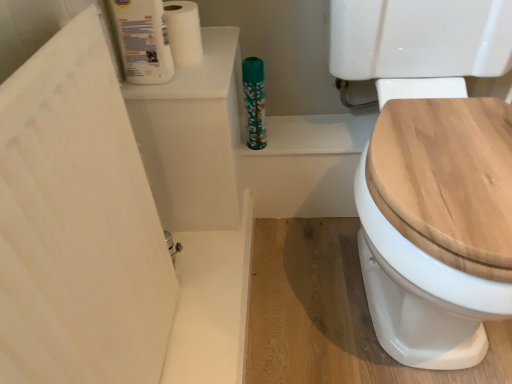
Question: Does white glossy toilet paper at upper left, the first toilet paper in the front-to-back sequence, have a larger size compared to wooden toilet seat at right?

Choices:
 (A) yes
 (B) no

Answer: (B)

Question: Does white glossy toilet paper at upper left, the first toilet paper in the front-to-back sequence, have a greater height compared to wooden toilet seat at right?

Choices:
 (A) yes
 (B) no

Answer: (B)

Question: Can you confirm if white glossy toilet paper at upper left, placed as the second toilet paper when sorted from back to front, is thinner than wooden toilet seat at right?

Choices:
 (A) yes
 (B) no

Answer: (A)

Question: Is the position of white glossy toilet paper at upper left, placed as the second toilet paper when sorted from back to front, less distant than that of wooden toilet seat at right?

Choices:
 (A) no
 (B) yes

Answer: (A)

Question: Considering the relative sizes of white glossy toilet paper at upper left, placed as the second toilet paper when sorted from back to front, and wooden toilet seat at right in the image provided, is white glossy toilet paper at upper left, placed as the second toilet paper when sorted from back to front, smaller than wooden toilet seat at right?

Choices:
 (A) yes
 (B) no

Answer: (A)

Question: Considering the positions of teal floral-patterned bottle at upper center and white matte toilet paper at upper left, positioned as the second toilet paper in front-to-back order, in the image, is teal floral-patterned bottle at upper center wider or thinner than white matte toilet paper at upper left, positioned as the second toilet paper in front-to-back order,?

Choices:
 (A) thin
 (B) wide

Answer: (A)

Question: In terms of height, does teal floral-patterned bottle at upper center look taller or shorter compared to white matte toilet paper at upper left, the first toilet paper in the back-to-front sequence?

Choices:
 (A) tall
 (B) short

Answer: (A)

Question: Do you think teal floral-patterned bottle at upper center is within white matte toilet paper at upper left, positioned as the second toilet paper in front-to-back order, or outside of it?

Choices:
 (A) inside
 (B) outside

Answer: (B)

Question: From a real-world perspective, is teal floral-patterned bottle at upper center physically located above or below white matte toilet paper at upper left, positioned as the second toilet paper in front-to-back order?

Choices:
 (A) above
 (B) below

Answer: (B)

Question: Is wooden toilet seat at right wider or thinner than white matte toilet paper at upper left, the first toilet paper in the back-to-front sequence?

Choices:
 (A) wide
 (B) thin

Answer: (A)

Question: From a real-world perspective, is wooden toilet seat at right physically located above or below white matte toilet paper at upper left, positioned as the second toilet paper in front-to-back order?

Choices:
 (A) below
 (B) above

Answer: (A)

Question: From their relative heights in the image, would you say wooden toilet seat at right is taller or shorter than white matte toilet paper at upper left, positioned as the second toilet paper in front-to-back order?

Choices:
 (A) tall
 (B) short

Answer: (A)

Question: Is wooden toilet seat at right to the left or to the right of white matte toilet paper at upper left, positioned as the second toilet paper in front-to-back order, in the image?

Choices:
 (A) right
 (B) left

Answer: (A)

Question: Looking at their shapes, would you say teal floral-patterned bottle at upper center is wider or thinner than white glossy toilet paper at upper left, placed as the second toilet paper when sorted from back to front?

Choices:
 (A) thin
 (B) wide

Answer: (A)

Question: Is teal floral-patterned bottle at upper center spatially inside white glossy toilet paper at upper left, the first toilet paper in the front-to-back sequence, or outside of it?

Choices:
 (A) outside
 (B) inside

Answer: (A)